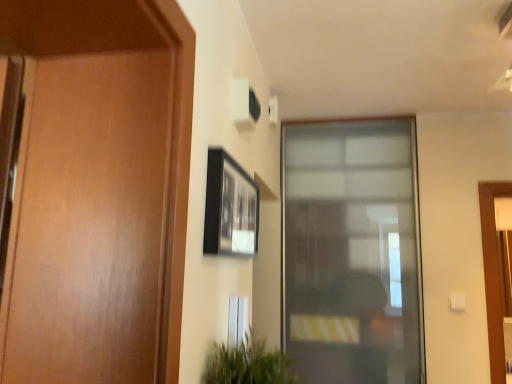
Question: Considering the relative sizes of black matte picture frame at upper center and green leafy plant at lower center in the image provided, is black matte picture frame at upper center shorter than green leafy plant at lower center?

Choices:
 (A) no
 (B) yes

Answer: (A)

Question: Is black matte picture frame at upper center not near green leafy plant at lower center?

Choices:
 (A) no
 (B) yes

Answer: (A)

Question: Is black matte picture frame at upper center to the left of green leafy plant at lower center from the viewer's perspective?

Choices:
 (A) no
 (B) yes

Answer: (B)

Question: Is black matte picture frame at upper center not inside green leafy plant at lower center?

Choices:
 (A) no
 (B) yes

Answer: (B)

Question: From a real-world perspective, is black matte picture frame at upper center located higher than green leafy plant at lower center?

Choices:
 (A) no
 (B) yes

Answer: (B)

Question: Considering their positions, is transparent glass window at center located in front of or behind green leafy plant at lower center?

Choices:
 (A) behind
 (B) front

Answer: (A)

Question: In terms of size, does transparent glass window at center appear bigger or smaller than green leafy plant at lower center?

Choices:
 (A) big
 (B) small

Answer: (A)

Question: Is transparent glass window at center wider or thinner than green leafy plant at lower center?

Choices:
 (A) thin
 (B) wide

Answer: (A)

Question: From the image's perspective, is transparent glass window at center positioned above or below green leafy plant at lower center?

Choices:
 (A) above
 (B) below

Answer: (A)

Question: From the image's perspective, is black matte picture frame at upper center located above or below transparent glass window at center?

Choices:
 (A) below
 (B) above

Answer: (B)

Question: From a real-world perspective, is black matte picture frame at upper center physically located above or below transparent glass window at center?

Choices:
 (A) below
 (B) above

Answer: (B)

Question: Is black matte picture frame at upper center to the left or to the right of transparent glass window at center in the image?

Choices:
 (A) left
 (B) right

Answer: (A)

Question: Is point (243, 170) closer or farther from the camera than point (372, 139)?

Choices:
 (A) closer
 (B) farther

Answer: (A)

Question: Is point click(x=407, y=226) closer or farther from the camera than point click(x=239, y=190)?

Choices:
 (A) farther
 (B) closer

Answer: (A)

Question: Based on their positions, is transparent glass window at center located to the left or right of black matte picture frame at upper center?

Choices:
 (A) right
 (B) left

Answer: (A)